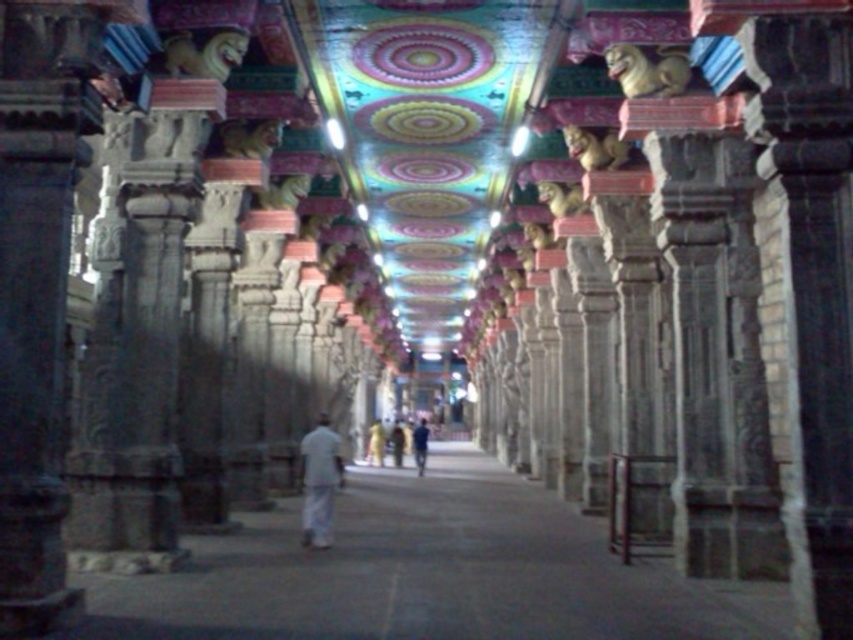
Which of these two, golden stone lion at upper right or golden statue at upper center, stands shorter?

Standing shorter between the two is golden stone lion at upper right.

Is golden stone lion at upper right to the right of golden statue at upper center from the viewer's perspective?

Indeed, golden stone lion at upper right is positioned on the right side of golden statue at upper center.

What are the coordinates of `golden stone lion at upper right` in the screenshot? It's located at (647, 68).

Which is behind, point (320, 541) or point (643, 60)?

The point (320, 541) is behind.

Is point (318, 444) closer to camera compared to point (688, 67)?

That is False.

At what (x,y) coordinates should I click in order to perform the action: click on white cloth at center. Please return your answer as a coordinate pair (x, y). This screenshot has width=853, height=640. Looking at the image, I should click on (318, 481).

What do you see at coordinates (318, 481) in the screenshot? The image size is (853, 640). I see `white cloth at center` at bounding box center [318, 481].

Is white cloth at center below white cotton robe at center?

Actually, white cloth at center is above white cotton robe at center.

Locate an element on the screen. white cloth at center is located at coordinates (318, 481).

At what (x,y) coordinates should I click in order to perform the action: click on white cloth at center. Please return your answer as a coordinate pair (x, y). The image size is (853, 640). Looking at the image, I should click on (318, 481).